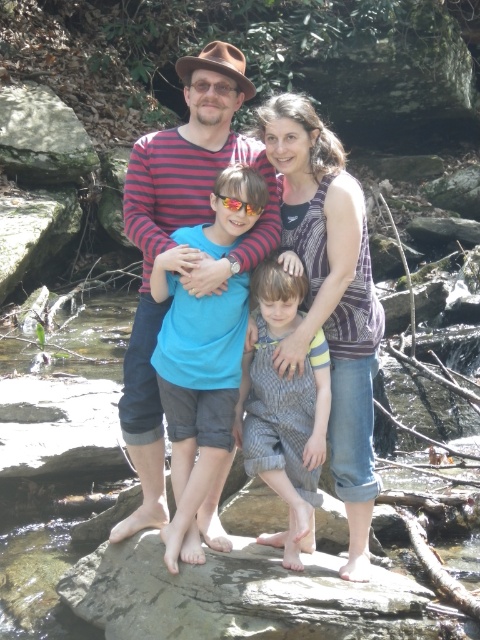
Question: Which of the following is the closest to the observer?

Choices:
 (A) striped fabric tank top at center
 (B) green mossy rock at upper left

Answer: (A)

Question: Which object is farther from the camera taking this photo?

Choices:
 (A) striped fabric tank top at center
 (B) striped cotton shirt at center

Answer: (B)

Question: Among these objects, which one is farthest from the camera?

Choices:
 (A) green mossy rock at upper left
 (B) striped cotton shirt at center

Answer: (A)

Question: Does striped cotton shirt at center lie behind green mossy rock at upper left?

Choices:
 (A) no
 (B) yes

Answer: (A)

Question: Does gray rough rock at center come behind gray striped overalls at center?

Choices:
 (A) yes
 (B) no

Answer: (B)

Question: Is striped cotton shirt at center positioned before striped fabric tank top at center?

Choices:
 (A) yes
 (B) no

Answer: (B)